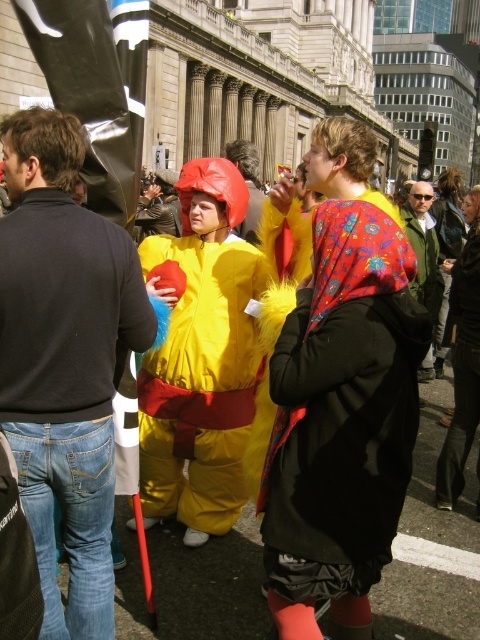
Does jeans at center have a lesser width compared to yellow fuzzy costume at center?

Indeed, jeans at center has a lesser width compared to yellow fuzzy costume at center.

Between point (94, 260) and point (239, 324), which one is positioned in front?

Point (94, 260)

I want to click on jeans at center, so click(x=64, y=360).

Measure the distance between floral fabric hood at center and yellow fuzzy costume at center.

23.91 feet

Is floral fabric hood at center to the left of yellow fuzzy costume at center from the viewer's perspective?

Incorrect, floral fabric hood at center is not on the left side of yellow fuzzy costume at center.

Which is behind, point (363, 342) or point (228, 440)?

Point (228, 440)

Locate an element on the screen. floral fabric hood at center is located at coordinates (342, 419).

Is yellow fuzzy costume at center to the right of green textured jacket at center from the viewer's perspective?

In fact, yellow fuzzy costume at center is to the left of green textured jacket at center.

Between yellow fuzzy costume at center and green textured jacket at center, which one is positioned lower?

Positioned lower is yellow fuzzy costume at center.

Where is `yellow fuzzy costume at center`? The height and width of the screenshot is (640, 480). yellow fuzzy costume at center is located at coordinates (202, 358).